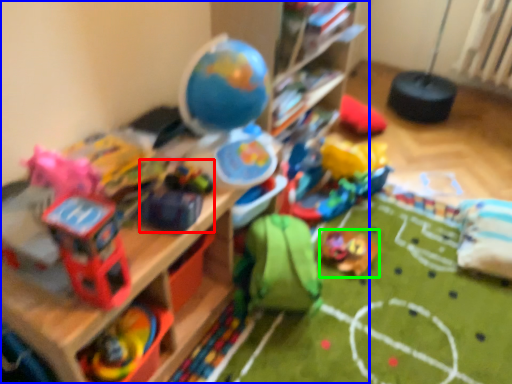
Question: Considering the real-world distances, which object is closest to toy (highlighted by a red box)? shelf (highlighted by a blue box) or toy (highlighted by a green box).

Choices:
 (A) shelf
 (B) toy

Answer: (A)